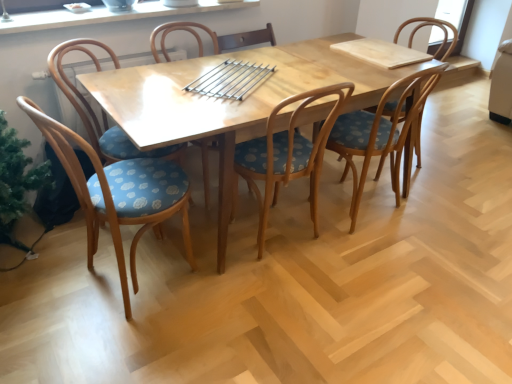
What is the approximate height of white glossy window sill at upper center?

white glossy window sill at upper center is 1.43 inches tall.

How much space does blue polka dot fabric chair at center, which appears as the 6th chair when viewed from the left, occupy vertically?

It is 34.05 inches.

Locate an element on the screen. The image size is (512, 384). natural wood table at center is located at coordinates (232, 101).

What do you see at coordinates (381, 131) in the screenshot?
I see `wooden chair with blue polka dot seat cushion at center, the 2th chair when ordered from right to left` at bounding box center [381, 131].

This screenshot has height=384, width=512. What do you see at coordinates (211, 38) in the screenshot?
I see `wooden chair with blue polka dot seat at center, the 4th chair from the right` at bounding box center [211, 38].

This screenshot has height=384, width=512. What do you see at coordinates (118, 193) in the screenshot? I see `blue polka dot wood chair at left, which appears as the fifth chair when viewed from the right` at bounding box center [118, 193].

At what (x,y) coordinates should I click in order to perform the action: click on white glossy window sill at upper center. Please return your answer as a coordinate pair (x, y). The image size is (512, 384). Looking at the image, I should click on (106, 15).

Is natural wood table at center far from white glossy window sill at upper center?

No, natural wood table at center is not far from white glossy window sill at upper center.

Considering the relative positions of natural wood table at center and white glossy window sill at upper center in the image provided, is natural wood table at center to the left of white glossy window sill at upper center from the viewer's perspective?

In fact, natural wood table at center is to the right of white glossy window sill at upper center.

At what (x,y) coordinates should I click in order to perform the action: click on kitchen & dining room table below the white glossy window sill at upper center (from the image's perspective). Please return your answer as a coordinate pair (x, y). Looking at the image, I should click on (232, 101).

Is white glossy window sill at upper center at the back of natural wood table at center?

natural wood table at center does not have its back to white glossy window sill at upper center.

From a real-world perspective, is wooden chair with blue polka dot seat at center, the 4th chair from the right, beneath blue polka dot wood chair at left, which appears as the fifth chair when viewed from the right?

No, from a real-world perspective, wooden chair with blue polka dot seat at center, the 4th chair from the right, is not under blue polka dot wood chair at left, which appears as the fifth chair when viewed from the right.

Are wooden chair with blue polka dot seat at center, the 4th chair from the right, and blue polka dot wood chair at left, which is the 2th chair from left to right, making contact?

No, wooden chair with blue polka dot seat at center, the 4th chair from the right, is not next to blue polka dot wood chair at left, which is the 2th chair from left to right.

Between wooden chair with blue polka dot seat at center, which is counted as the third chair, starting from the left, and blue polka dot wood chair at left, which is the 2th chair from left to right, which one has larger width?

wooden chair with blue polka dot seat at center, which is counted as the third chair, starting from the left, is wider.

Who is taller, blue polka dot wood chair at left, which is the 2th chair from left to right, or blue polka dot fabric chair at center, acting as the 1th chair starting from the right?

blue polka dot wood chair at left, which is the 2th chair from left to right.

Are blue polka dot wood chair at left, which is the 2th chair from left to right, and blue polka dot fabric chair at center, which appears as the 6th chair when viewed from the left, beside each other?

blue polka dot wood chair at left, which is the 2th chair from left to right, and blue polka dot fabric chair at center, which appears as the 6th chair when viewed from the left, are not in contact.

Measure the distance from blue polka dot wood chair at left, which appears as the fifth chair when viewed from the right, to blue polka dot fabric chair at center, which appears as the 6th chair when viewed from the left.

blue polka dot wood chair at left, which appears as the fifth chair when viewed from the right, and blue polka dot fabric chair at center, which appears as the 6th chair when viewed from the left, are 1.82 meters apart.

In the image, is blue polka dot fabric chair at left, the sixth chair when ordered from right to left, on the left side or the right side of wooden chair with blue polka dot seat at center, the 4th chair from the right?

From the image, it's evident that blue polka dot fabric chair at left, the sixth chair when ordered from right to left, is to the left of wooden chair with blue polka dot seat at center, the 4th chair from the right.

From the image's perspective, which is below, blue polka dot fabric chair at left, which is the first chair from left to right, or wooden chair with blue polka dot seat at center, which is counted as the third chair, starting from the left?

blue polka dot fabric chair at left, which is the first chair from left to right, from the image's perspective.

Identify the location of chair that is the 2nd one when counting leftward from the wooden chair with blue polka dot seat at center, which is counted as the third chair, starting from the left. The height and width of the screenshot is (384, 512). (101, 110).

Which is farther from the camera, (139, 185) or (187, 26)?

The point (187, 26) is behind.

Is blue polka dot wood chair at left, which is the 2th chair from left to right, positioned behind wooden chair with blue polka dot seat at center, the 4th chair from the right?

No, it is in front of wooden chair with blue polka dot seat at center, the 4th chair from the right.

From the image's perspective, which one is positioned higher, blue polka dot wood chair at left, which is the 2th chair from left to right, or wooden chair with blue polka dot seat at center, the 4th chair from the right?

wooden chair with blue polka dot seat at center, the 4th chair from the right, is shown above in the image.

Identify the location of the 1st chair to the right of the blue polka dot wood chair at left, which appears as the fifth chair when viewed from the right, starting your count from the anchor. (211, 38).

From the image's perspective, relative to blue polka dot fabric chair at left, the sixth chair when ordered from right to left, is wooden chair with blue polka dot seat at center, acting as the 4th chair starting from the left, above or below?

wooden chair with blue polka dot seat at center, acting as the 4th chair starting from the left, is situated lower than blue polka dot fabric chair at left, the sixth chair when ordered from right to left, in the image.

Which is correct: wooden chair with blue polka dot seat at center, which ranks as the 3th chair in right-to-left order, is inside blue polka dot fabric chair at left, the sixth chair when ordered from right to left, or outside of it?

wooden chair with blue polka dot seat at center, which ranks as the 3th chair in right-to-left order, is outside blue polka dot fabric chair at left, the sixth chair when ordered from right to left.

Can you tell me how much wooden chair with blue polka dot seat at center, acting as the 4th chair starting from the left, and blue polka dot fabric chair at left, the sixth chair when ordered from right to left, differ in facing direction?

wooden chair with blue polka dot seat at center, acting as the 4th chair starting from the left, and blue polka dot fabric chair at left, the sixth chair when ordered from right to left, are facing 146 degrees away from each other.

Is wooden chair with blue polka dot seat at center, acting as the 4th chair starting from the left, placed right next to white glossy window sill at upper center?

No.

Is wooden chair with blue polka dot seat at center, which ranks as the 3th chair in right-to-left order, oriented away from white glossy window sill at upper center?

No, wooden chair with blue polka dot seat at center, which ranks as the 3th chair in right-to-left order, is not facing the opposite direction of white glossy window sill at upper center.

Is point (315, 157) behind point (203, 1)?

That is False.

Which object is thinner, wooden chair with blue polka dot seat at center, acting as the 4th chair starting from the left, or white glossy window sill at upper center?

Thinner between the two is white glossy window sill at upper center.

Locate an element on the screen. The height and width of the screenshot is (384, 512). window sill that is above the natural wood table at center (from a real-world perspective) is located at coordinates (106, 15).

You are a GUI agent. You are given a task and a screenshot of the screen. Output one action in this format:
    pyautogui.click(x=<x>, y=<y>)
    Task: Click on the chair that is the 3rd object directly below the wooden chair with blue polka dot seat at center, the 4th chair from the right (from a real-world perspective)
    The width and height of the screenshot is (512, 384).
    Given the screenshot: What is the action you would take?
    pyautogui.click(x=118, y=193)

Based on their spatial positions, is blue polka dot fabric chair at left, the sixth chair when ordered from right to left, or wooden chair with blue polka dot seat at center, acting as the 4th chair starting from the left, further from blue polka dot fabric chair at center, acting as the 1th chair starting from the right?

Among the two, blue polka dot fabric chair at left, the sixth chair when ordered from right to left, is located further to blue polka dot fabric chair at center, acting as the 1th chair starting from the right.

Estimate the real-world distances between objects in this image. Which object is further from blue polka dot fabric chair at center, acting as the 1th chair starting from the right, white glossy window sill at upper center or wooden chair with blue polka dot seat cushion at center, which is counted as the 5th chair, starting from the left?

The object further to blue polka dot fabric chair at center, acting as the 1th chair starting from the right, is white glossy window sill at upper center.

Which object lies nearer to the anchor point white glossy window sill at upper center, natural wood table at center or blue polka dot fabric chair at center, acting as the 1th chair starting from the right?

natural wood table at center.

Based on their spatial positions, is blue polka dot fabric chair at center, acting as the 1th chair starting from the right, or wooden chair with blue polka dot seat cushion at center, which is counted as the 5th chair, starting from the left, further from blue polka dot fabric chair at left, the sixth chair when ordered from right to left?

The object further to blue polka dot fabric chair at left, the sixth chair when ordered from right to left, is blue polka dot fabric chair at center, acting as the 1th chair starting from the right.

Looking at the image, which one is located closer to natural wood table at center, blue polka dot fabric chair at left, which is the first chair from left to right, or wooden chair with blue polka dot seat cushion at center, the 2th chair when ordered from right to left?

wooden chair with blue polka dot seat cushion at center, the 2th chair when ordered from right to left.

Which object lies nearer to the anchor point blue polka dot wood chair at left, which appears as the fifth chair when viewed from the right, blue polka dot fabric chair at left, which is the first chair from left to right, or wooden chair with blue polka dot seat at center, the 4th chair from the right?

blue polka dot fabric chair at left, which is the first chair from left to right, is positioned closer to the anchor blue polka dot wood chair at left, which appears as the fifth chair when viewed from the right.

In the scene shown: When comparing their distances from wooden chair with blue polka dot seat at center, acting as the 4th chair starting from the left, does blue polka dot fabric chair at center, which appears as the 6th chair when viewed from the left, or natural wood table at center seem closer?

natural wood table at center is positioned closer to the anchor wooden chair with blue polka dot seat at center, acting as the 4th chair starting from the left.

Based on their spatial positions, is wooden chair with blue polka dot seat at center, the 4th chair from the right, or blue polka dot fabric chair at center, acting as the 1th chair starting from the right, closer to blue polka dot wood chair at left, which appears as the fifth chair when viewed from the right?

wooden chair with blue polka dot seat at center, the 4th chair from the right, is positioned closer to the anchor blue polka dot wood chair at left, which appears as the fifth chair when viewed from the right.

At what (x,y) coordinates should I click in order to perform the action: click on kitchen & dining room table positioned between blue polka dot wood chair at left, which is the 2th chair from left to right, and wooden chair with blue polka dot seat at center, which is counted as the third chair, starting from the left, from near to far. Please return your answer as a coordinate pair (x, y). Looking at the image, I should click on (232, 101).

I want to click on kitchen & dining room table situated between blue polka dot wood chair at left, which appears as the fifth chair when viewed from the right, and wooden chair with blue polka dot seat cushion at center, which is counted as the 5th chair, starting from the left, from left to right, so click(x=232, y=101).

Identify the location of kitchen & dining room table between white glossy window sill at upper center and blue polka dot fabric chair at center, acting as the 1th chair starting from the right, from left to right. (232, 101).

This screenshot has width=512, height=384. I want to click on kitchen & dining room table between blue polka dot wood chair at left, which is the 2th chair from left to right, and wooden chair with blue polka dot seat at center, acting as the 4th chair starting from the left, from left to right, so click(232, 101).